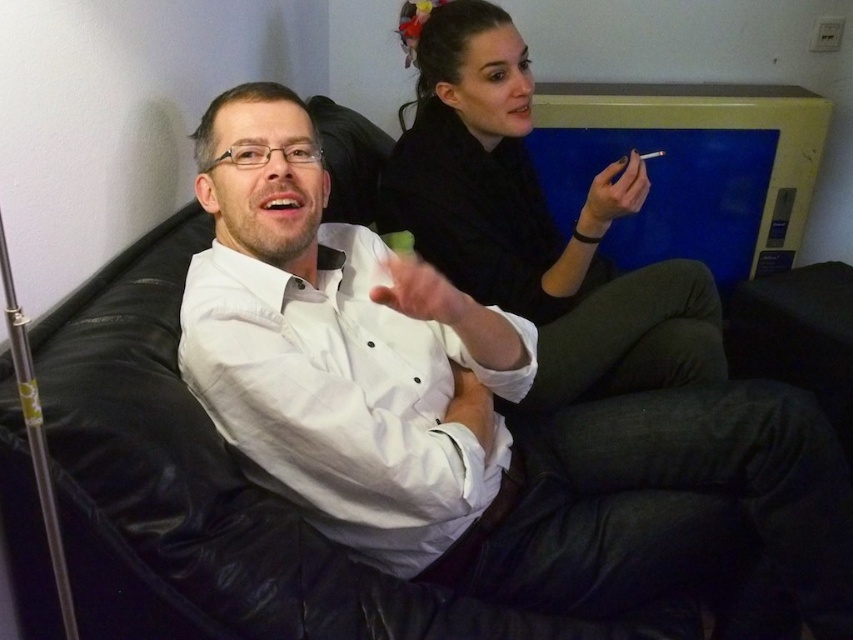
You are designing a new seating arrangement for a photo shoot and need to ensure that the white matte shirt at center and the black matte shirt at upper right are positioned so that the white one is wider than the black one. Given the current setup, is this requirement already met?

The white matte shirt at center might be wider than black matte shirt at upper right, so the requirement is possibly already met.

You are an interior designer planning to place a decorative item between the black matte shirt at upper right and the matte white cigarette at upper center. Based on their sizes, which object should you consider placing closer to the smaller one to maintain balance?

The matte white cigarette at upper center is smaller than the black matte shirt at upper right. To maintain balance, place the decorative item closer to the matte white cigarette at upper center.

You are standing in front of the couch where two people are sitting. You want to place a small vase exactly at the point with coordinates point (527, 403). If you are 1.5 meters away from the couch, will the vase be placed within reach of the person on the left?

The distance of point (527, 403) from camera is 1.40 meters. Since you are 1.5 meters away from the couch, the vase will be placed 0.1 meters in front of you, so the person on the left might be able to reach it depending on their arm length.